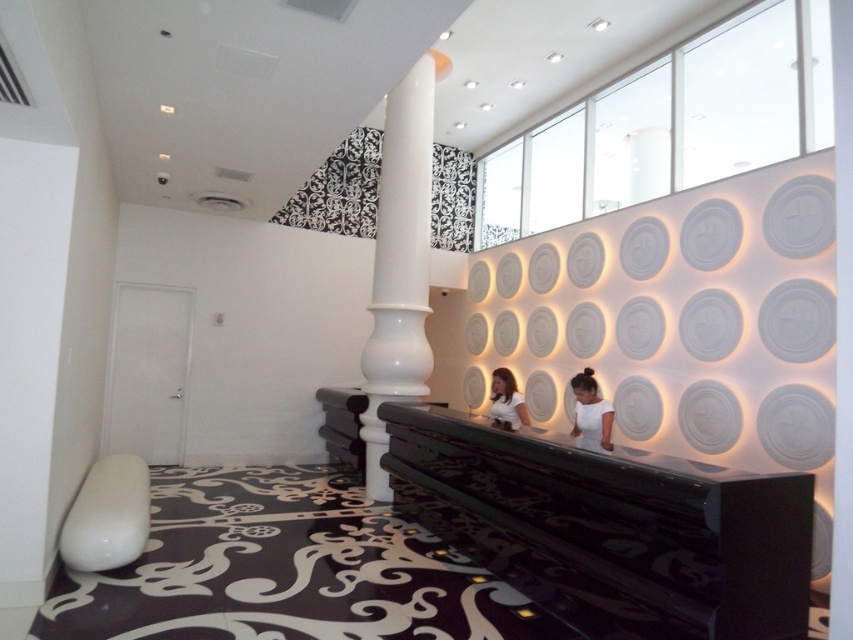
Question: Among these points, which one is nearest to the camera?

Choices:
 (A) (518, 493)
 (B) (421, 148)
 (C) (514, 388)

Answer: (A)

Question: Does black glossy balustrade at center have a lesser width compared to white glossy shirt at center?

Choices:
 (A) no
 (B) yes

Answer: (A)

Question: Is white glossy column at center bigger than white matte shirt at center?

Choices:
 (A) yes
 (B) no

Answer: (A)

Question: Which point appears closest to the camera in this image?

Choices:
 (A) (582, 371)
 (B) (408, 140)

Answer: (B)

Question: Which point is closer to the camera?

Choices:
 (A) white matte shirt at center
 (B) black glossy balustrade at center
 (C) white glossy column at center

Answer: (B)

Question: Does black glossy balustrade at center have a greater width compared to white glossy column at center?

Choices:
 (A) yes
 (B) no

Answer: (A)